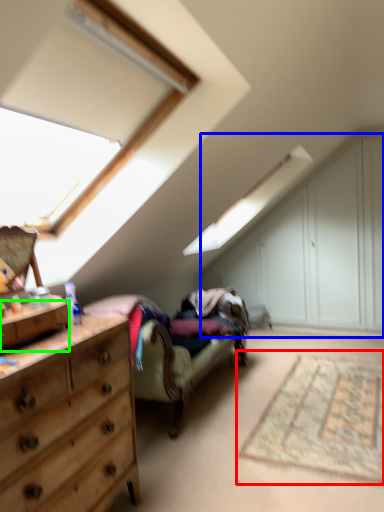
Question: Which is farther away from mat (highlighted by a red box)? dresser (highlighted by a blue box) or drawer (highlighted by a green box)?

Choices:
 (A) dresser
 (B) drawer

Answer: (A)